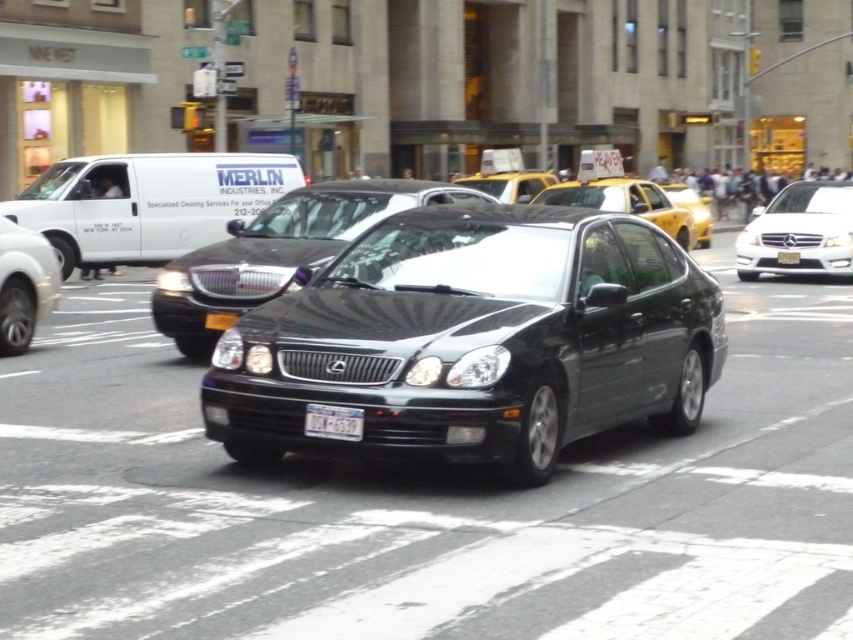
Who is positioned more to the right, yellow matte taxi at upper right or yellow matte taxi at center?

Positioned to the right is yellow matte taxi at upper right.

Does point (573, 196) come closer to viewer compared to point (506, 172)?

Yes, it is in front of point (506, 172).

Which is in front, point (532, 200) or point (471, 177)?

Point (532, 200) is in front.

Locate an element on the screen. Image resolution: width=853 pixels, height=640 pixels. yellow matte taxi at upper right is located at coordinates (625, 202).

Which is more to the left, shiny black sedan at center or white plastic license plate at center?

From the viewer's perspective, shiny black sedan at center appears more on the left side.

Is shiny black sedan at center shorter than white plastic license plate at center?

In fact, shiny black sedan at center may be taller than white plastic license plate at center.

Is point (296, 230) closer to viewer compared to point (315, 420)?

No, (296, 230) is further to viewer.

This screenshot has width=853, height=640. Find the location of `shiny black sedan at center`. shiny black sedan at center is located at coordinates (277, 252).

Who is more forward, (28, 189) or (686, 198)?

Point (28, 189) is in front.

Is white matte van at left to the left of yellow glossy taxi at upper right from the viewer's perspective?

Yes, white matte van at left is to the left of yellow glossy taxi at upper right.

Locate an element on the screen. The height and width of the screenshot is (640, 853). white matte van at left is located at coordinates (148, 202).